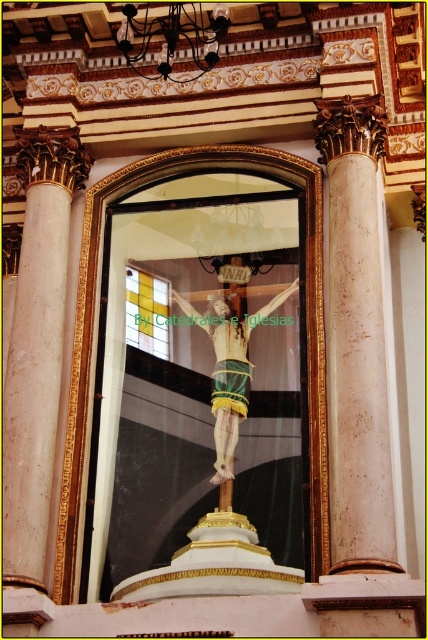
Between point (377, 161) and point (15, 296), which one is positioned in front?

Point (15, 296)

Does point (382, 508) lie in front of point (56, 307)?

Yes, point (382, 508) is in front of point (56, 307).

Where is `white marble column at right`? Image resolution: width=428 pixels, height=640 pixels. white marble column at right is located at coordinates (356, 339).

The image size is (428, 640). I want to click on transparent glass crucifix at center, so click(202, 392).

Image resolution: width=428 pixels, height=640 pixels. What do you see at coordinates (202, 392) in the screenshot?
I see `transparent glass crucifix at center` at bounding box center [202, 392].

Identify the location of transparent glass crucifix at center. (202, 392).

What are the coordinates of `transparent glass crucifix at center` in the screenshot? It's located at (202, 392).

Which is more to the right, transparent glass crucifix at center or white marble column at right?

Positioned to the right is white marble column at right.

Is transparent glass crucifix at center shorter than white marble column at right?

Indeed, transparent glass crucifix at center has a lesser height compared to white marble column at right.

Is point (202, 371) less distant than point (341, 408)?

No, (202, 371) is further to viewer.

I want to click on transparent glass crucifix at center, so click(202, 392).